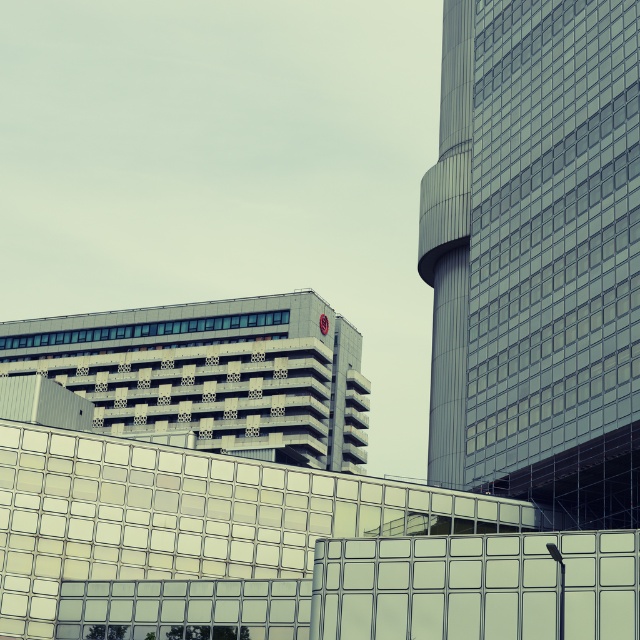
Question: Among these objects, which one is farthest from the camera?

Choices:
 (A) glassy steel tower at right
 (B) gray concrete building at upper left

Answer: (B)

Question: Is glassy steel tower at right bigger than gray concrete building at upper left?

Choices:
 (A) no
 (B) yes

Answer: (A)

Question: Which object appears closest to the camera in this image?

Choices:
 (A) gray concrete building at upper left
 (B) glassy steel tower at right

Answer: (B)

Question: Is glassy steel tower at right below gray concrete building at upper left?

Choices:
 (A) no
 (B) yes

Answer: (A)

Question: Does glassy steel tower at right lie behind gray concrete building at upper left?

Choices:
 (A) no
 (B) yes

Answer: (A)